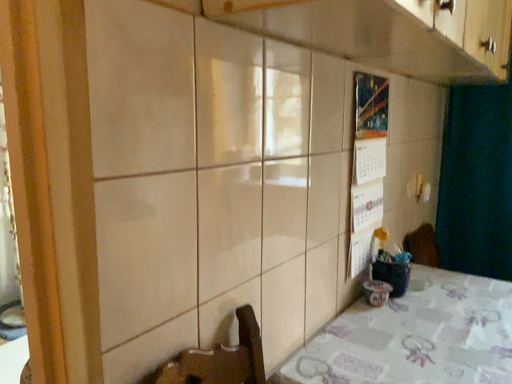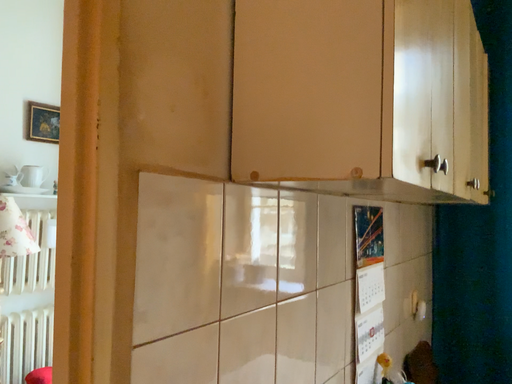
Question: How did the camera likely rotate when shooting the video?

Choices:
 (A) rotated downward
 (B) rotated upward

Answer: (B)